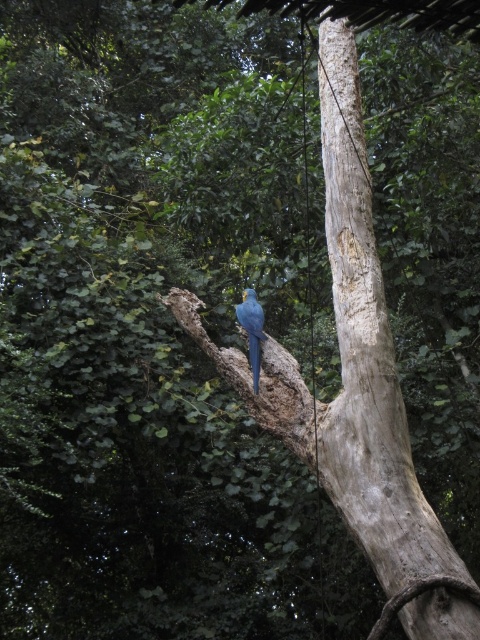
Based on the scene description, where is the smooth brown tree trunk at center located in terms of its 2D coordinates?

The smooth brown tree trunk at center is located at the 2D coordinates of point (x=367, y=356).

You are a birdwatcher observing the scene. You notice the smooth brown tree trunk at center and the blue glossy parrot at center. Which of these two objects is bigger in size?

The smooth brown tree trunk at center is larger in size than the blue glossy parrot at center.